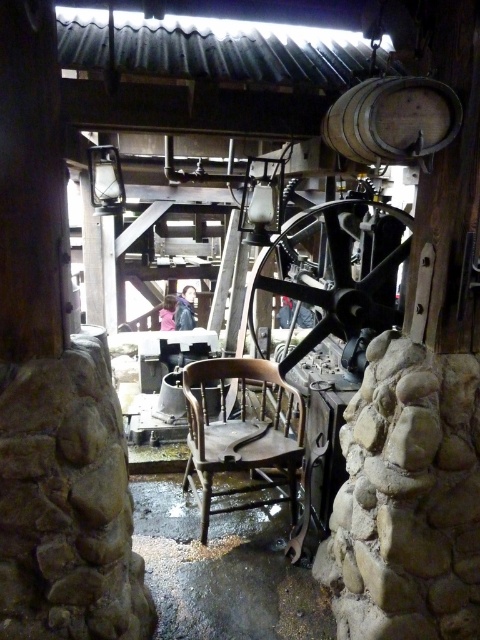
Question: Does wooden chair at center appear over wooden barrel at upper center?

Choices:
 (A) yes
 (B) no

Answer: (B)

Question: From the image, what is the correct spatial relationship of wooden chair at center in relation to wooden barrel at upper center?

Choices:
 (A) below
 (B) above

Answer: (A)

Question: Which point is farther from the camera taking this photo?

Choices:
 (A) (195, 438)
 (B) (456, 102)

Answer: (A)

Question: Does wooden chair at center have a lesser width compared to wooden barrel at upper center?

Choices:
 (A) yes
 (B) no

Answer: (B)